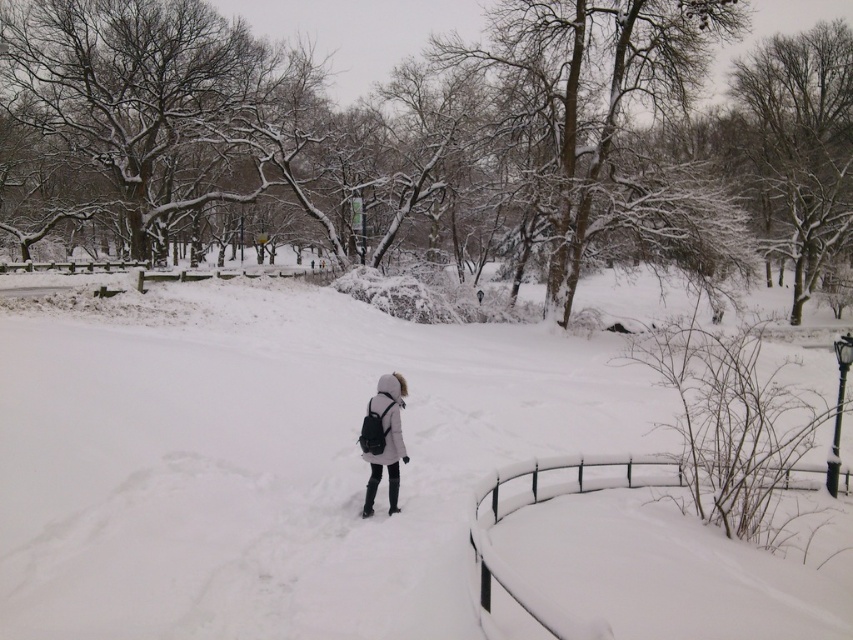
Question: Which object appears closest to the camera in this image?

Choices:
 (A) white fluffy snow at center
 (B) white matte coat at center

Answer: (A)

Question: Which of the following is the farthest from the observer?

Choices:
 (A) (393, 401)
 (B) (326, 292)

Answer: (B)

Question: Does white fluffy snow at center appear over white matte coat at center?

Choices:
 (A) no
 (B) yes

Answer: (B)

Question: In this image, where is white fluffy snow at center located relative to white matte coat at center?

Choices:
 (A) left
 (B) right

Answer: (A)

Question: Which object appears closest to the camera in this image?

Choices:
 (A) white matte coat at center
 (B) white fluffy snow at center

Answer: (B)

Question: Does white fluffy snow at center come in front of white matte coat at center?

Choices:
 (A) no
 (B) yes

Answer: (B)